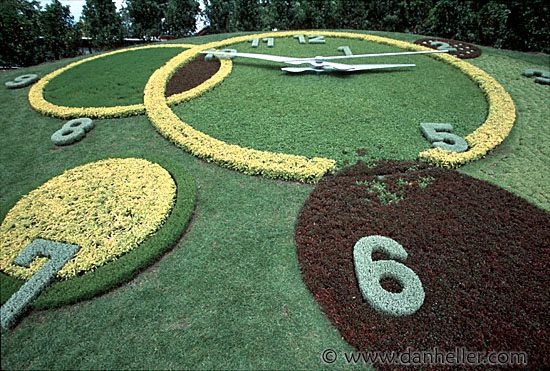
Locate an element on the screen. clock hands is located at coordinates (266, 55), (395, 53).